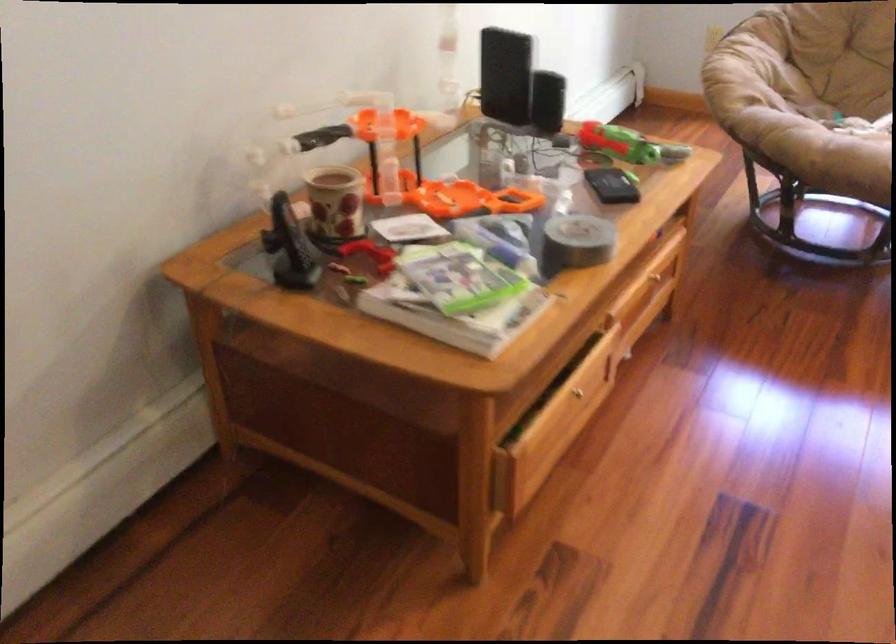
This screenshot has width=896, height=644. I want to click on black smartphone, so click(x=613, y=185).